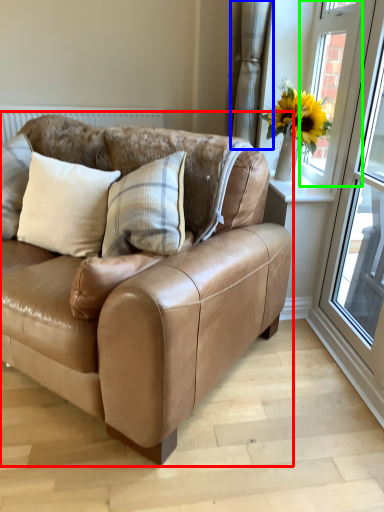
Question: Which object is the farthest from studio couch (highlighted by a red box)? Choose among these: curtain (highlighted by a blue box) or window (highlighted by a green box).

Choices:
 (A) curtain
 (B) window

Answer: (A)